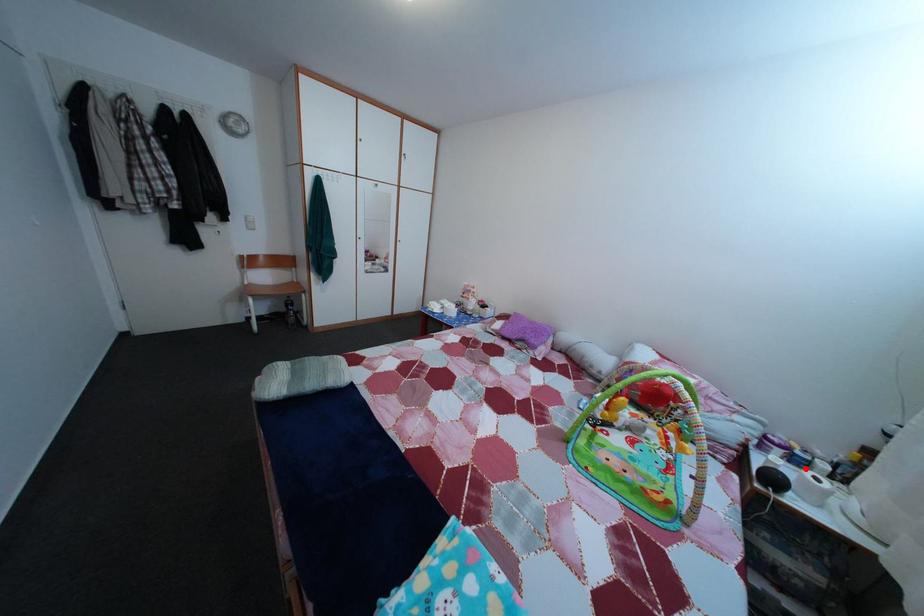
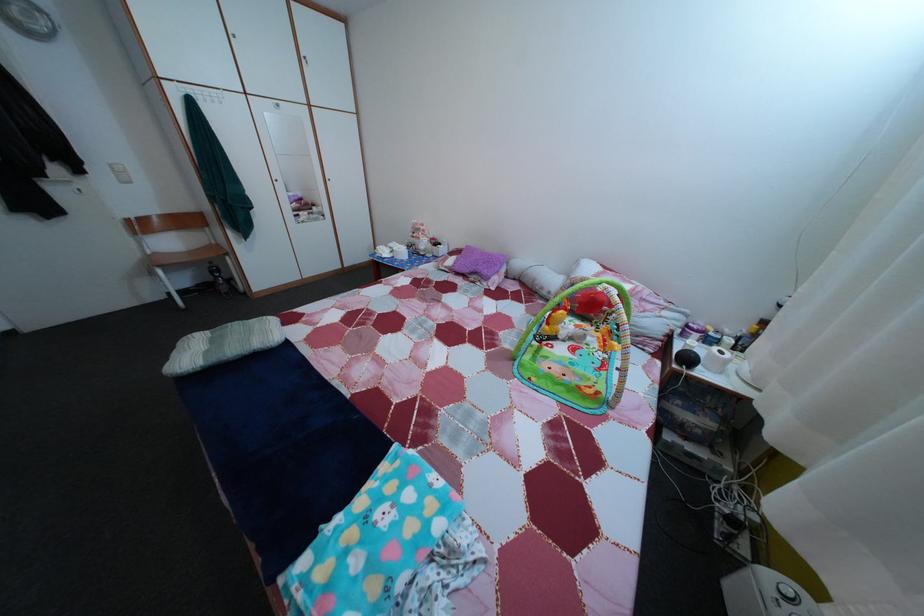
Question: I am providing you with two images of the same scene from different viewpoints. Image1 has a red point marked. In image2, the corresponding 3D location appears at what relative position? Reply with the corresponding letter.

Choices:
 (A) Closer
 (B) Farther

Answer: (A)